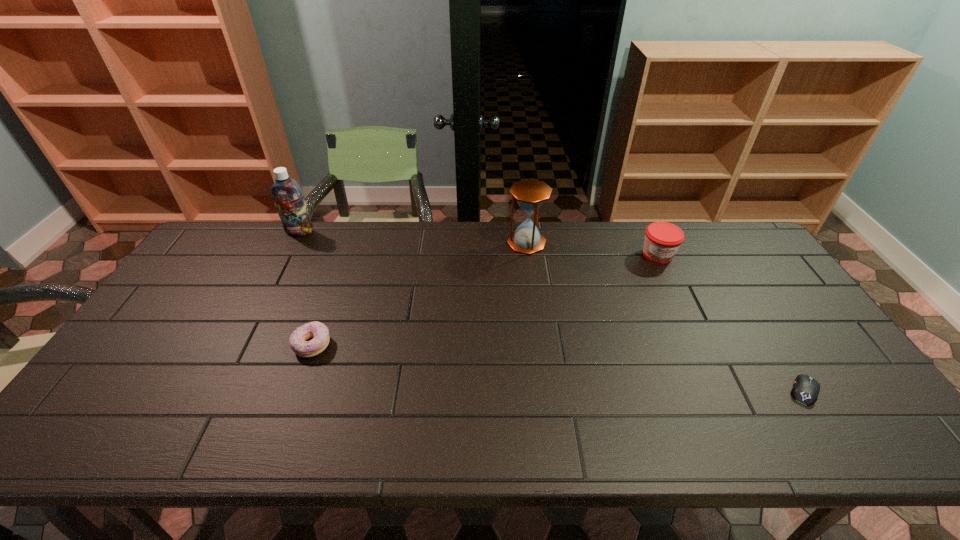
Where is `free space between the doughnut and the jam`? This screenshot has width=960, height=540. free space between the doughnut and the jam is located at coordinates (485, 300).

This screenshot has height=540, width=960. I want to click on vacant space in between the jam and the nearest object, so click(x=732, y=323).

The width and height of the screenshot is (960, 540). What are the coordinates of `vacant space that is in between the jam and the third object from left to right` in the screenshot? It's located at (592, 249).

This screenshot has width=960, height=540. Find the location of `object that can be found as the third closest to the third object from left to right`. object that can be found as the third closest to the third object from left to right is located at coordinates (288, 197).

Identify which object is the closest to the fourth shortest object. Please provide its 2D coordinates. Your answer should be formatted as a tuple, i.e. [(x, y)], where the tuple contains the x and y coordinates of a point satisfying the conditions above.

[(662, 239)]

The width and height of the screenshot is (960, 540). I want to click on vacant space that satisfies the following two spatial constraints: 1. on the label side of the rightmost object; 2. on the left side of the third tallest object, so click(722, 390).

Image resolution: width=960 pixels, height=540 pixels. I want to click on vacant point that satisfies the following two spatial constraints: 1. on the label side of the third shortest object; 2. on the left side of the rightmost object, so click(722, 390).

Find the location of a particular element. vacant position in the image that satisfies the following two spatial constraints: 1. on the front label of the computer equipment; 2. on the left side of the leftmost object is located at coordinates (219, 390).

Find the location of `vacant space that satisfies the following two spatial constraints: 1. on the front label of the shampoo; 2. on the left side of the rightmost object`. vacant space that satisfies the following two spatial constraints: 1. on the front label of the shampoo; 2. on the left side of the rightmost object is located at coordinates (219, 390).

Find the location of a particular element. vacant space that satisfies the following two spatial constraints: 1. on the label side of the nearest object; 2. on the left side of the third tallest object is located at coordinates (722, 390).